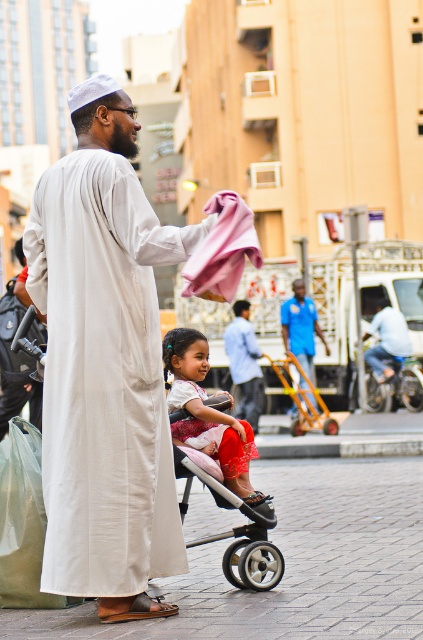
You are a photographer trying to capture the man in the matte white robe at center and the silver metallic stroller at center. Which object should you focus on first if you want to photograph the one closer to you?

The matte white robe at center is positioned on the left side of the silver metallic stroller at center, so it is closer to you and should be focused on first.